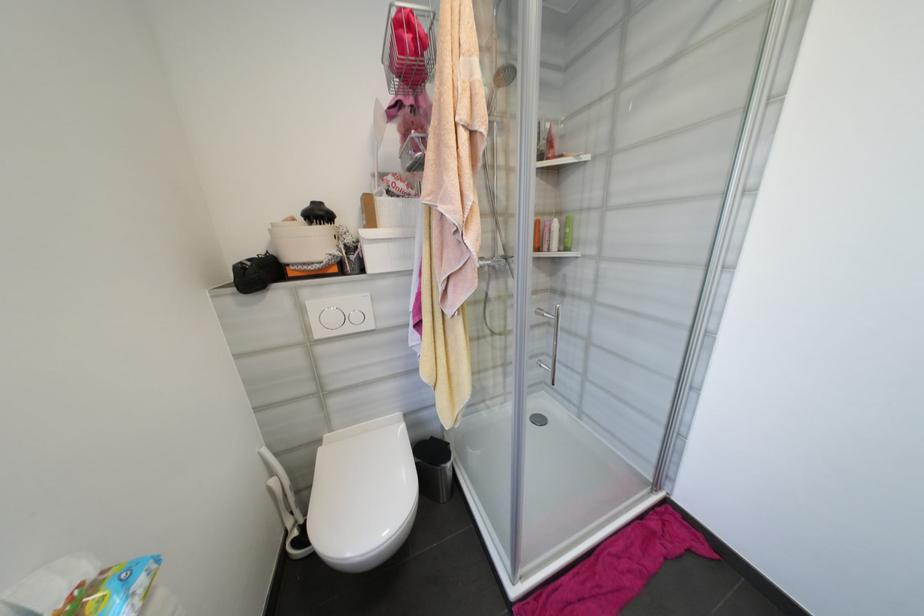
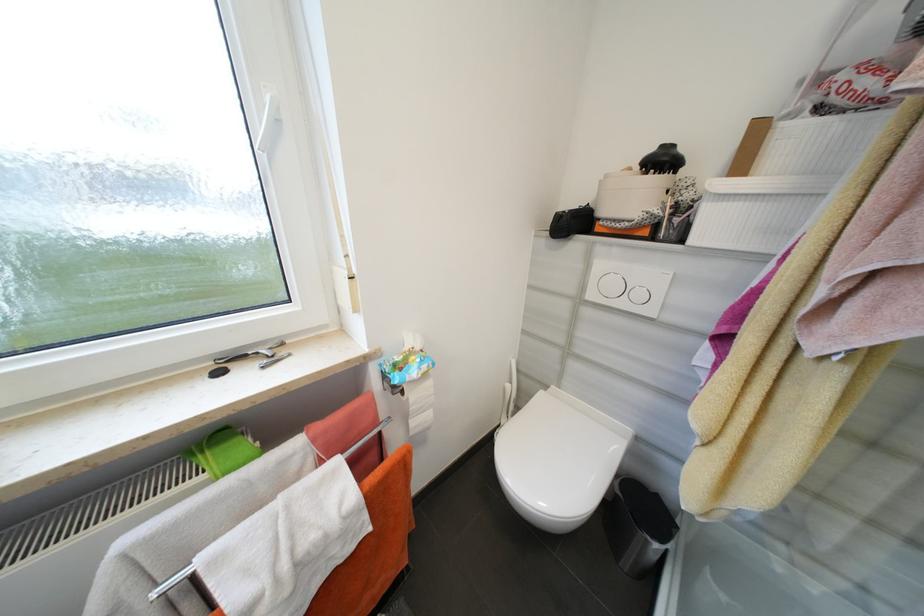
The point at (277, 482) is marked in the first image. Where is the corresponding point in the second image?

(514, 387)